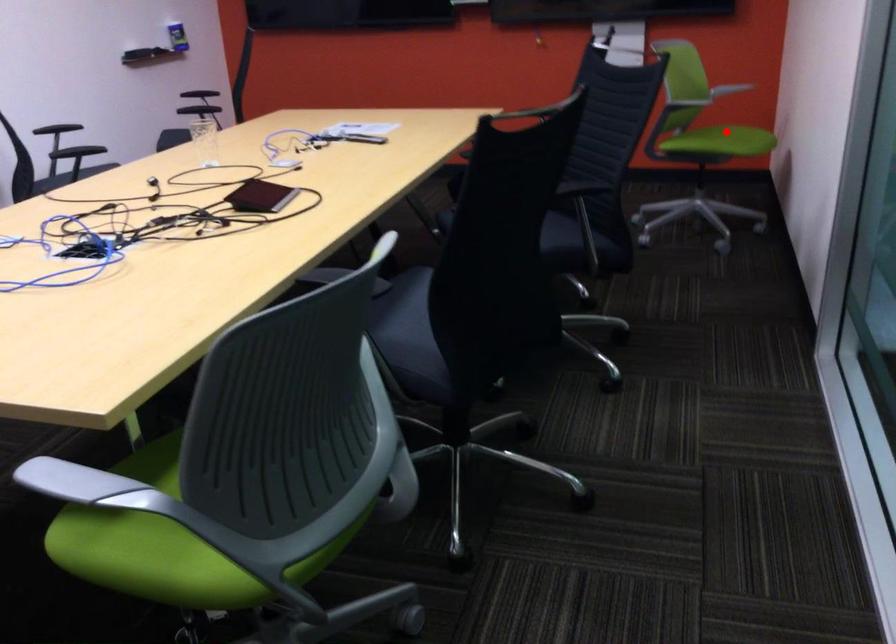
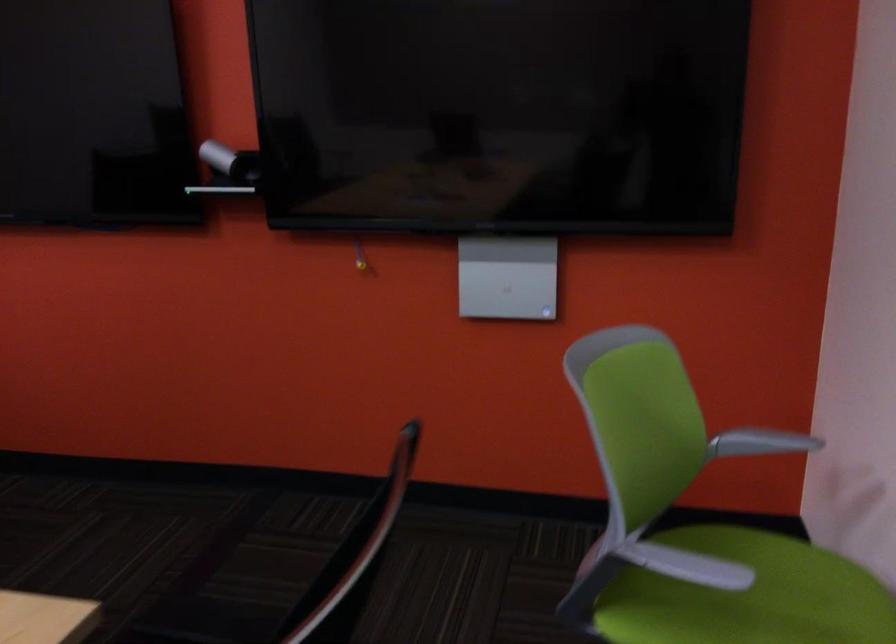
Where in the second image is the point corresponding to the highlighted location from the first image?

(747, 596)